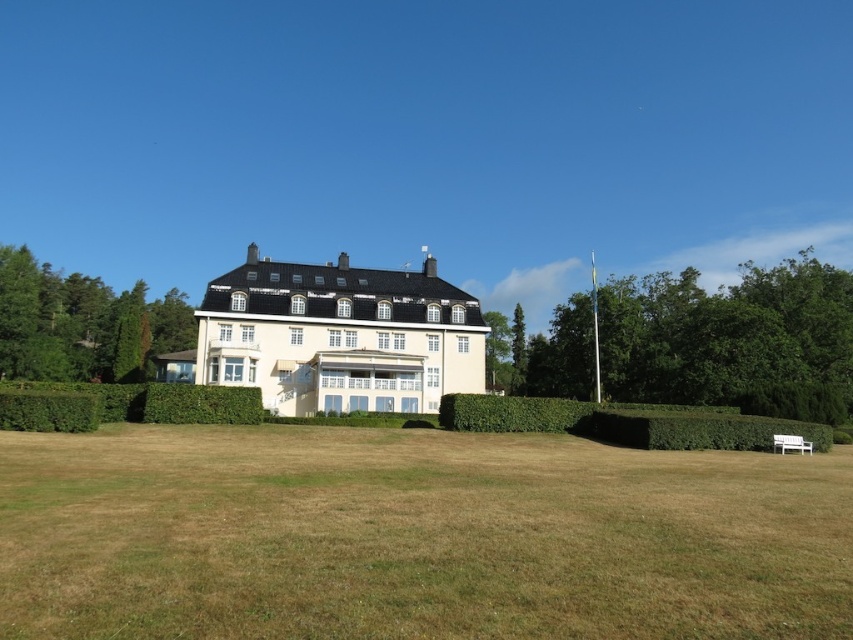
Question: Considering the relative positions of green leafy tree at right and green leafy hedge at lower left in the image provided, where is green leafy tree at right located with respect to green leafy hedge at lower left?

Choices:
 (A) above
 (B) below

Answer: (A)

Question: Does brown grass at center have a greater width compared to green leafy tree at left?

Choices:
 (A) yes
 (B) no

Answer: (B)

Question: Which point appears farthest from the camera in this image?

Choices:
 (A) (850, 332)
 (B) (148, 358)

Answer: (B)

Question: Is green leafy hedge at lower right above green leafy hedge at lower left?

Choices:
 (A) yes
 (B) no

Answer: (B)

Question: Which object appears closest to the camera in this image?

Choices:
 (A) green leafy hedge at lower left
 (B) green leafy tree at right
 (C) green leafy tree at left

Answer: (A)

Question: Which point is closer to the camera taking this photo?

Choices:
 (A) (548, 401)
 (B) (793, 525)

Answer: (B)